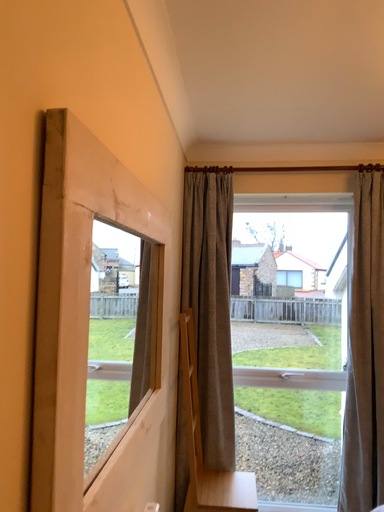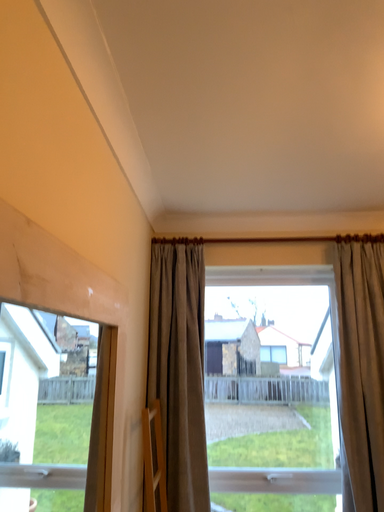
Question: Which way did the camera rotate in the video?

Choices:
 (A) rotated upward
 (B) rotated downward

Answer: (A)